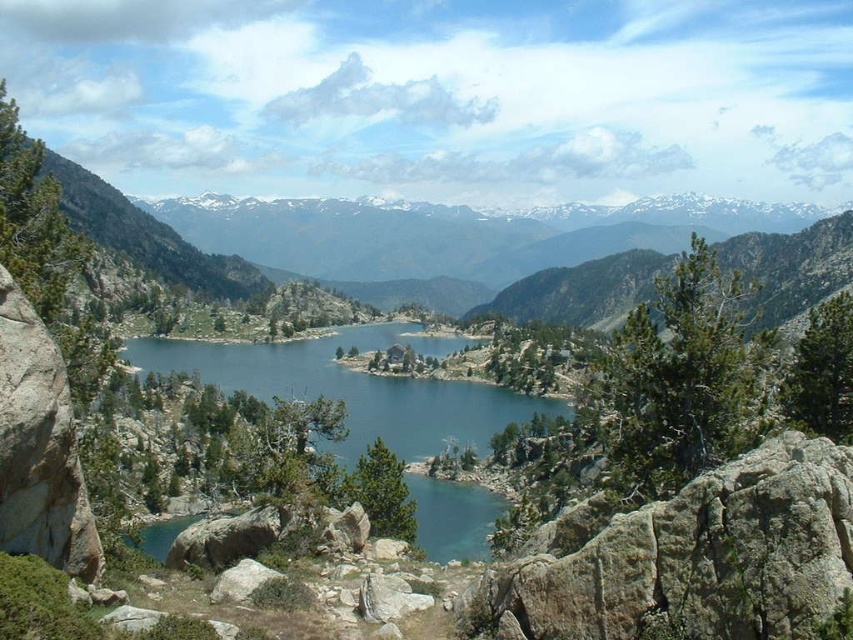
Question: Considering the real-world distances, which object is farthest from the green grassy mountain at center?

Choices:
 (A) turquoise glassy water at center
 (B) rocky cliff at lower right

Answer: (B)

Question: Is green grassy mountain at center further to camera compared to rocky cliff at lower right?

Choices:
 (A) no
 (B) yes

Answer: (B)

Question: Does rocky cliff at lower right have a larger size compared to gray rock at lower left?

Choices:
 (A) yes
 (B) no

Answer: (A)

Question: Does green grassy mountain at center have a larger size compared to turquoise glassy water at center?

Choices:
 (A) no
 (B) yes

Answer: (B)

Question: Which object appears farthest from the camera in this image?

Choices:
 (A) gray rock at lower left
 (B) rocky cliff at lower right

Answer: (A)

Question: Which object is the farthest from the rocky cliff at lower right?

Choices:
 (A) gray rock at lower left
 (B) brown rough rock at left

Answer: (B)